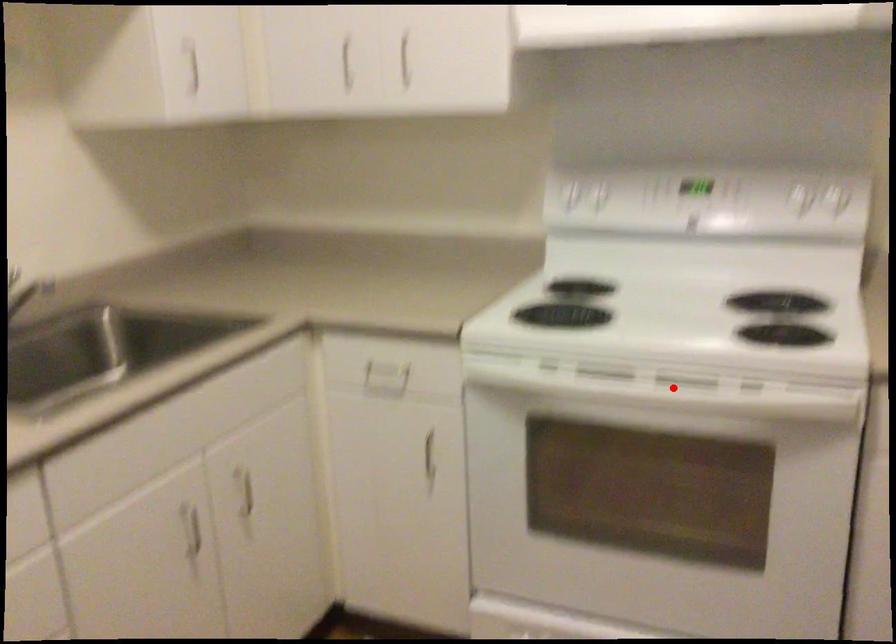
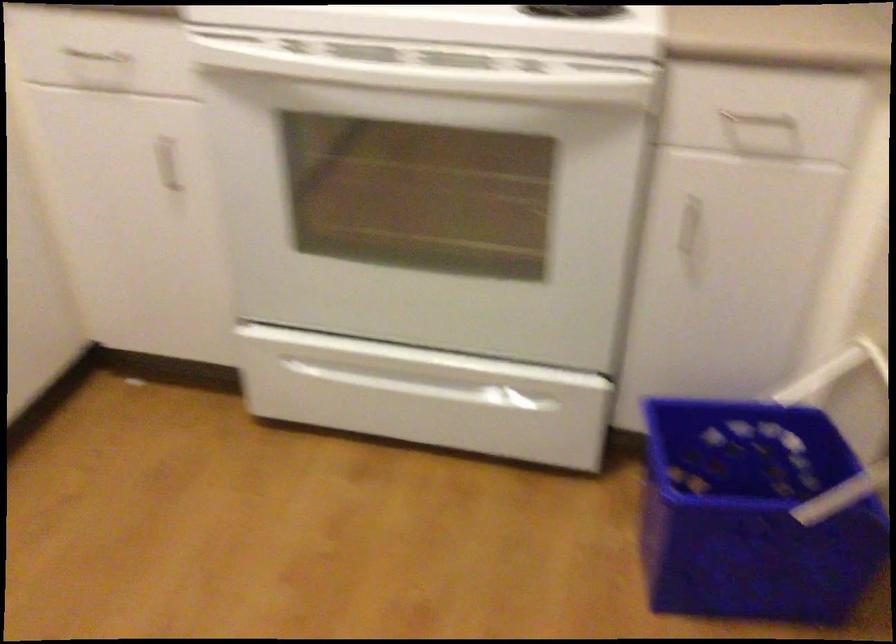
Question: I am providing you with two images of the same scene from different viewpoints. Given a red point in image1, look at the same physical point in image2. Is it:

Choices:
 (A) Closer to the viewpoint
 (B) Farther from the viewpoint

Answer: (A)